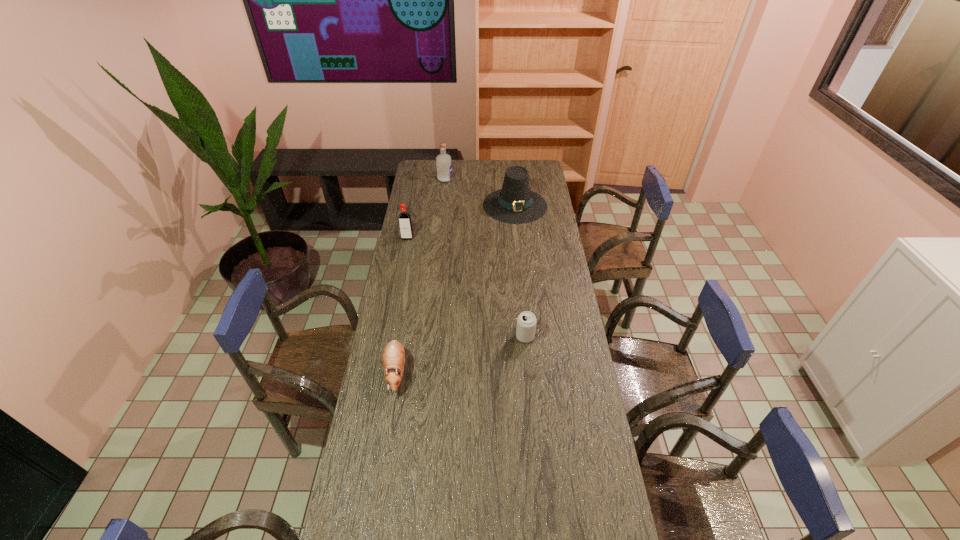
Find the location of a particular element. This screenshot has width=960, height=540. free location located 0.230m on the front of the can is located at coordinates (531, 396).

You are a GUI agent. You are given a task and a screenshot of the screen. Output one action in this format:
    pyautogui.click(x=<x>, y=<y>)
    Task: Click on the vacant space located 0.160m at the face of the nearest object
    This screenshot has height=540, width=960.
    Given the screenshot: What is the action you would take?
    pyautogui.click(x=384, y=442)

Locate an element on the screen. The width and height of the screenshot is (960, 540). object that is at the far edge is located at coordinates pyautogui.click(x=443, y=161).

The height and width of the screenshot is (540, 960). What are the coordinates of `hamster present at the left edge` in the screenshot? It's located at (393, 357).

Where is `object positioned at the right edge`? object positioned at the right edge is located at coordinates (515, 204).

The image size is (960, 540). I want to click on object located in the far left corner section of the desktop, so click(x=443, y=161).

You are a GUI agent. You are given a task and a screenshot of the screen. Output one action in this format:
    pyautogui.click(x=<x>, y=<y>)
    Task: Click on the free space at the far edge of the desktop
    
    Given the screenshot: What is the action you would take?
    pyautogui.click(x=474, y=170)

This screenshot has height=540, width=960. What are the coordinates of `free location at the left edge` in the screenshot? It's located at (377, 461).

I want to click on free space at the right edge of the desktop, so click(x=540, y=244).

Locate an element on the screen. vacant region at the far right corner of the desktop is located at coordinates (532, 180).